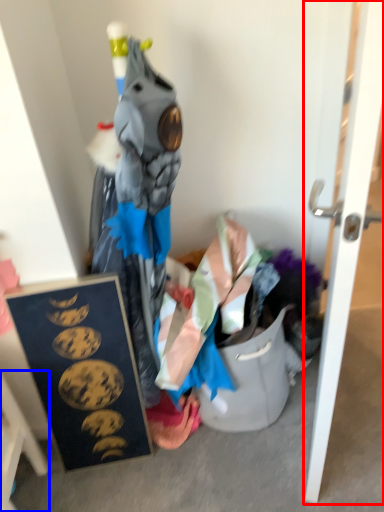
Question: Which object is closer to the camera taking this photo, door (highlighted by a red box) or furniture (highlighted by a blue box)?

Choices:
 (A) door
 (B) furniture

Answer: (A)